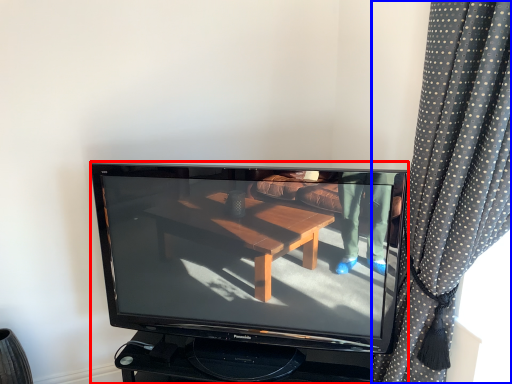
Question: Which of the following is the closest to the observer, television (highlighted by a red box) or curtain (highlighted by a blue box)?

Choices:
 (A) television
 (B) curtain

Answer: (B)